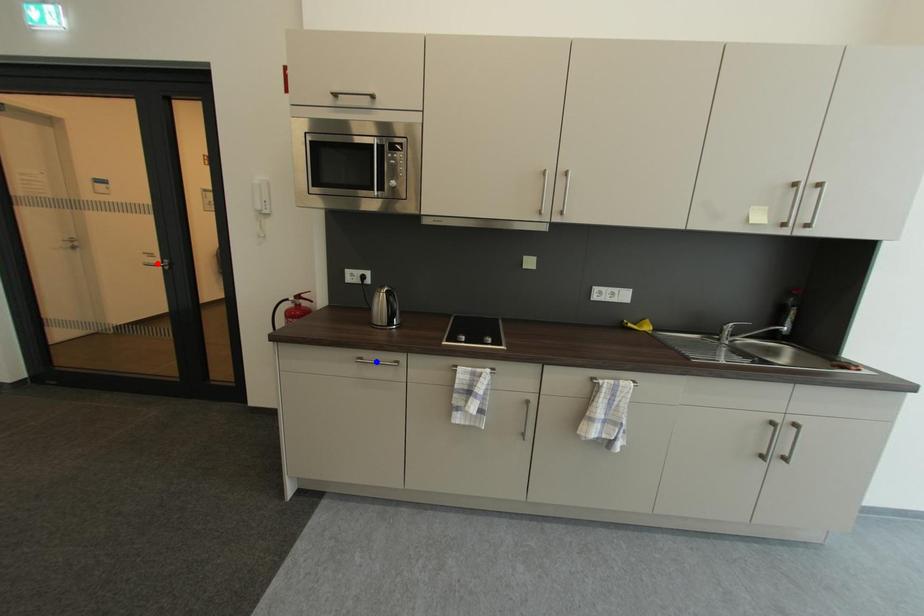
Question: Which of the two points in the image is closer to the camera?

Choices:
 (A) Blue point is closer.
 (B) Red point is closer.

Answer: (A)